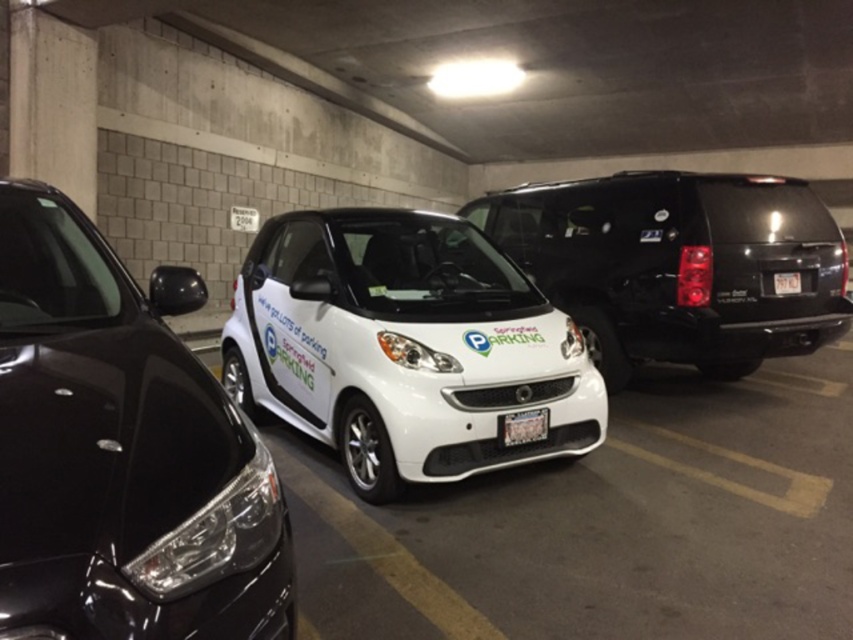
You are a delivery person trying to fit a large package into the trunk of the white glossy smart car at center. You notice a white plastic license plate at center attached to the car. Considering the car and license plate, which one is taller?

The white glossy smart car at center is much taller than the white plastic license plate at center, so the car is taller. Therefore, the trunk space might be sufficient for the package if the license plate doesn not obstruct it.

You are standing at the point with coordinates (122, 451) in the parking garage. What vehicle is located exactly at this point?

The glossy black SUV at left is located exactly at the point with coordinates (122, 451).